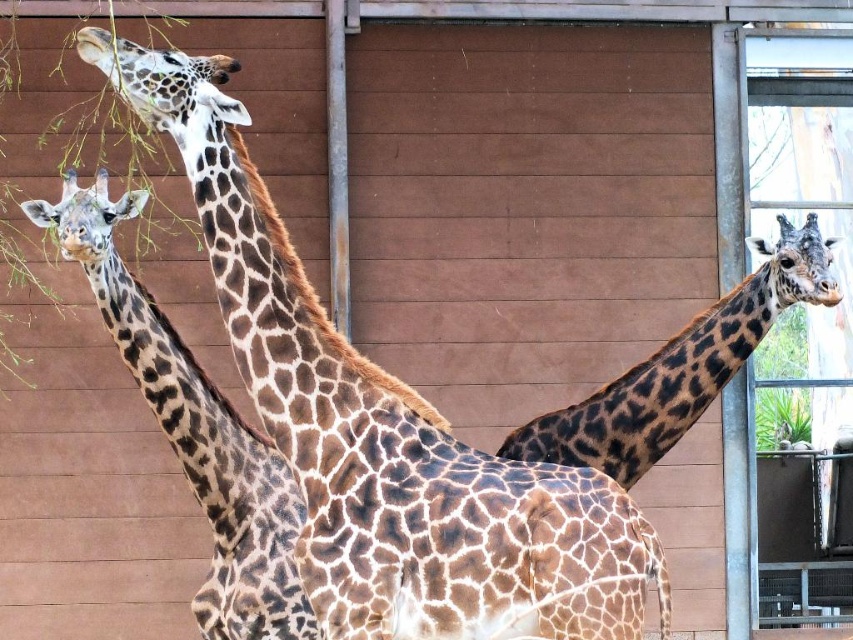
You are a zoo visitor standing in front of the enclosure. You want to take a photo of both the brown spotted giraffe at upper left and the spotted fur giraffe at right. Which giraffe will appear larger in your photo?

The brown spotted giraffe at upper left will appear larger in your photo because it is closer to the viewer than the spotted fur giraffe at right.

You are a zookeeper trying to determine which giraffe needs more space in their enclosure. Based on the image, which giraffe is wider between the brown spotted giraffe at upper left and the brown spotted giraffe at left?

The brown spotted giraffe at upper left is wider than the brown spotted giraffe at left, so it may require more space in the enclosure.